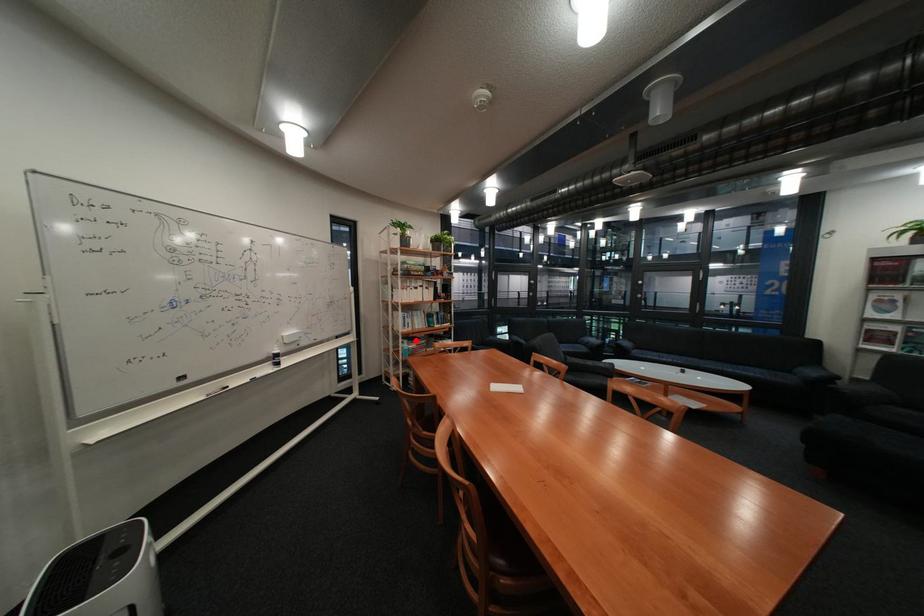
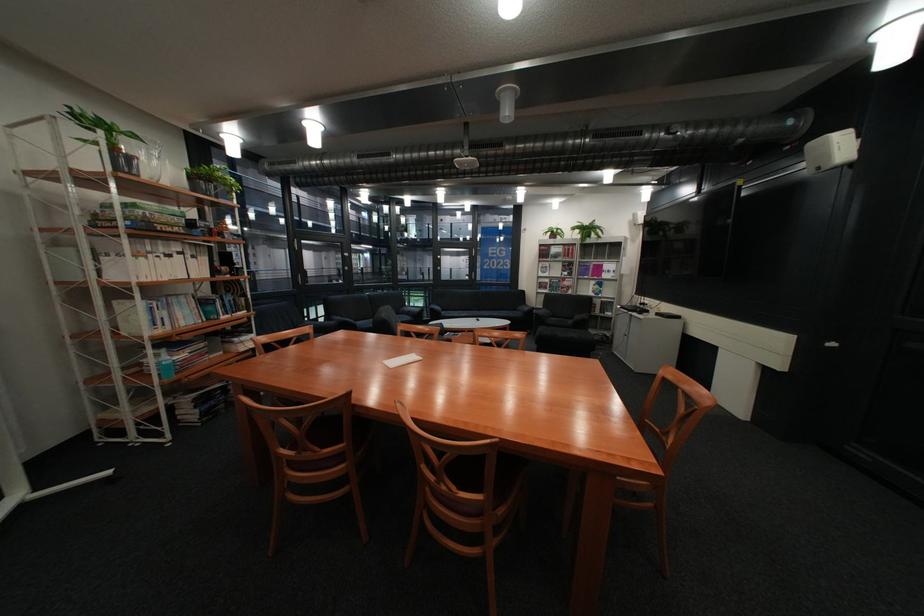
In the second image, find the point that corresponds to the highlighted location in the first image.

(165, 351)